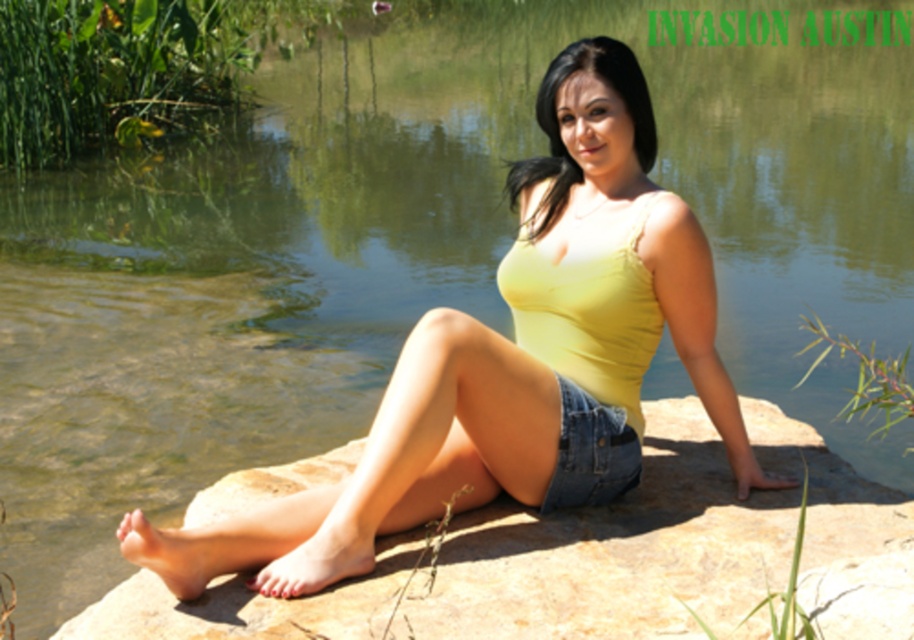
You are a fashion designer observing the person in the scene. You need to create a new outfit that maintains the same color scheme but swaps the positions of the yellow matte tank top at center and denim shorts at center. Is this feasible based on their current positions?

The yellow matte tank top at center is positioned on the left side of denim shorts at center. Swapping their positions would require moving the tank top to the right and the shorts to the left, which is feasible as their positions are not fixed by the scene context.

You are a photographer trying to capture the yellow matte tank top at center and the brown textured rock at center in a single shot. Based on their positions, which object would appear closer to the camera in the photo?

The yellow matte tank top at center appears closer to the camera because it is positioned above the brown textured rock at center, which is lower in the scene.

You are a fashion designer observing the person in the image. You need to determine the order of the yellow matte tank top at center and denim shorts at center from top to bottom. Which one comes first?

The yellow matte tank top at center is above the denim shorts at center, so it comes first from top to bottom.